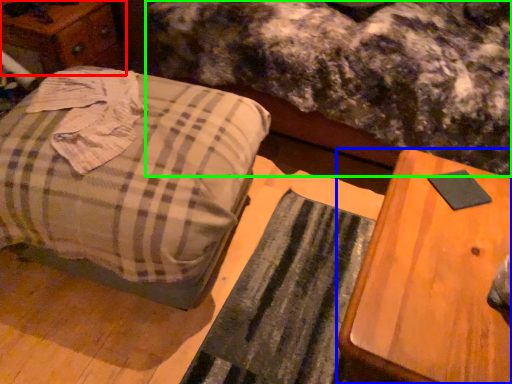
Question: Which object is positioned closest to dresser (highlighted by a red box)? Select from table (highlighted by a blue box) and mattress (highlighted by a green box).

Choices:
 (A) table
 (B) mattress

Answer: (B)